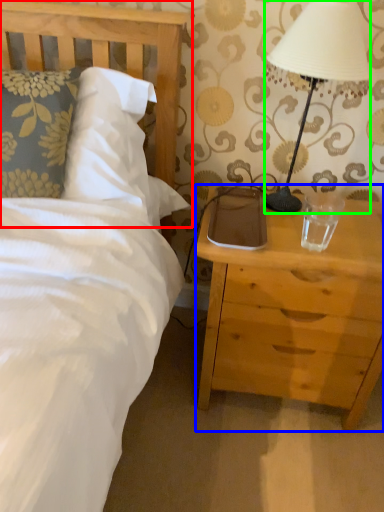
Question: Estimate the real-world distances between objects in this image. Which object is farther from headboard (highlighted by a red box), nightstand (highlighted by a blue box) or lamp (highlighted by a green box)?

Choices:
 (A) nightstand
 (B) lamp

Answer: (A)